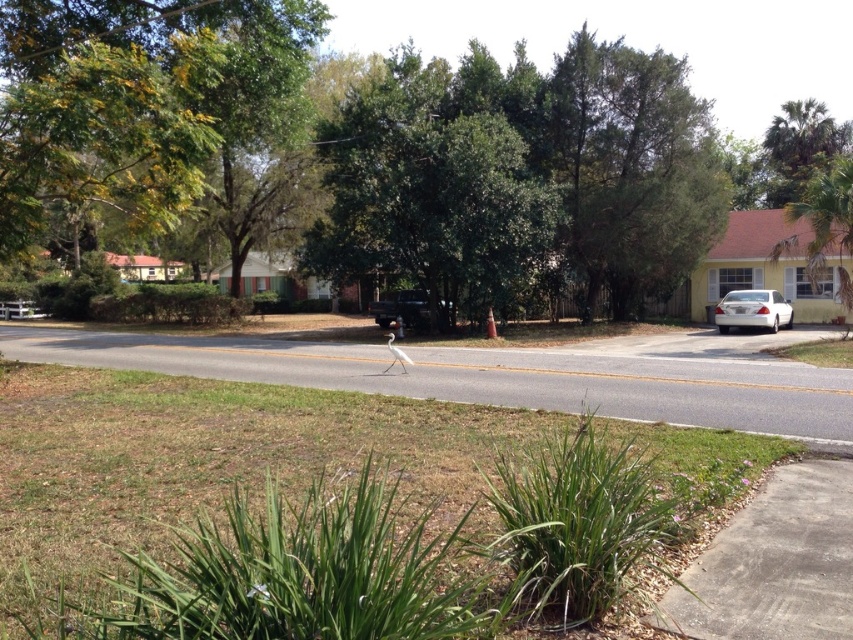
Question: Which is farther from the green leafy tree at upper left?

Choices:
 (A) green leafy tree at center
 (B) matte black truck at center
 (C) green leafy palm tree at upper right
 (D) white glossy sedan at right

Answer: (C)

Question: Does green leafy tree at upper right have a lesser width compared to white glossy sedan at right?

Choices:
 (A) no
 (B) yes

Answer: (A)

Question: Is green leafy tree at center below green leafy tree at upper right?

Choices:
 (A) no
 (B) yes

Answer: (B)

Question: Which object is farther from the camera taking this photo?

Choices:
 (A) green leafy palm tree at upper right
 (B) green leafy tree at upper left
 (C) green leafy tree at center
 (D) white glossy sedan at right

Answer: (A)

Question: Which object is positioned closest to the green leafy tree at upper right?

Choices:
 (A) green leafy tree at center
 (B) green leafy palm tree at upper right
 (C) green leafy tree at upper left
 (D) matte black truck at center

Answer: (A)

Question: Is green leafy tree at upper right smaller than green leafy palm tree at upper right?

Choices:
 (A) no
 (B) yes

Answer: (B)